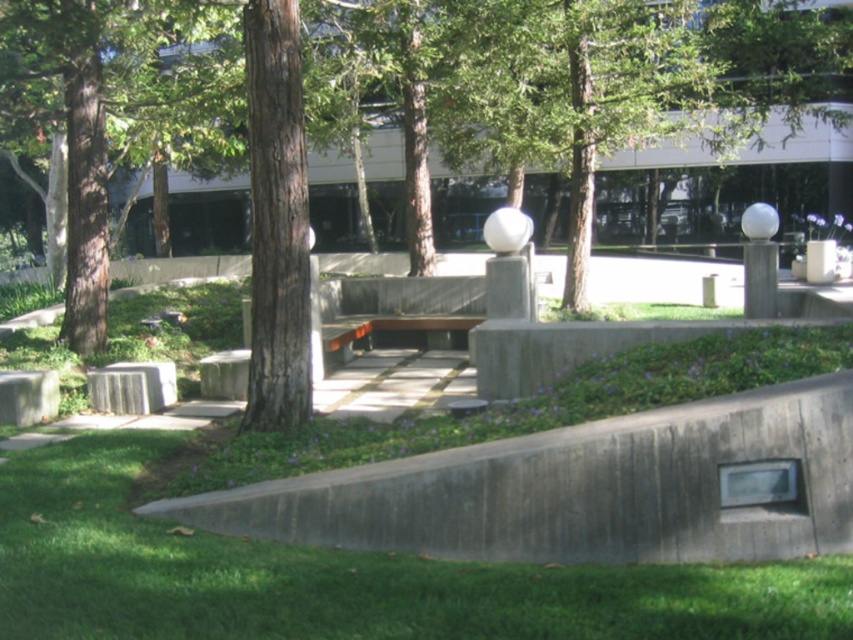
How far apart are green grass at lower left and concrete bench at center?

green grass at lower left is 54.22 centimeters from concrete bench at center.

Can you confirm if green grass at lower left is positioned above concrete bench at center?

No, green grass at lower left is not above concrete bench at center.

Where is `green grass at lower left`? The width and height of the screenshot is (853, 640). green grass at lower left is located at coordinates (340, 576).

Identify the location of green grass at lower left. The image size is (853, 640). (340, 576).

Can you confirm if brown rough bark tree at center is positioned to the left of wooden park bench at center?

Correct, you'll find brown rough bark tree at center to the left of wooden park bench at center.

Who is higher up, brown rough bark tree at center or wooden park bench at center?

Positioned higher is brown rough bark tree at center.

Where is `brown rough bark tree at center`? This screenshot has width=853, height=640. brown rough bark tree at center is located at coordinates (277, 220).

Is green grass at lower left shorter than brown rough bark tree at center?

Yes.

Between point (718, 598) and point (252, 220), which one is positioned behind?

The point (252, 220) is behind.

Describe the element at coordinates (340, 576) in the screenshot. Image resolution: width=853 pixels, height=640 pixels. I see `green grass at lower left` at that location.

Locate an element on the screen. This screenshot has width=853, height=640. green grass at lower left is located at coordinates (340, 576).